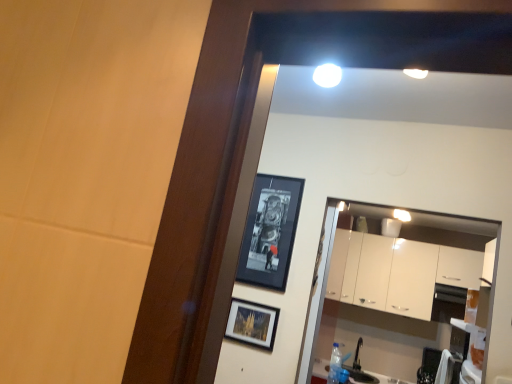
The image size is (512, 384). What do you see at coordinates (270, 231) in the screenshot? I see `black glossy picture frame at upper center, the first picture frame from the top` at bounding box center [270, 231].

The width and height of the screenshot is (512, 384). Find the location of `white glossy cabinets at center`. white glossy cabinets at center is located at coordinates (397, 272).

From a real-world perspective, between black glossy picture frame at upper center, which is counted as the second picture frame, starting from the bottom, and white glossy cabinets at center, who is vertically higher?

From a 3D spatial view, white glossy cabinets at center is above.

From the image's perspective, who appears lower, black glossy picture frame at upper center, the first picture frame from the top, or white glossy cabinets at center?

From the image's view, white glossy cabinets at center is below.

How much distance is there between black glossy picture frame at upper center, the first picture frame from the top, and white glossy cabinets at center?

black glossy picture frame at upper center, the first picture frame from the top, is 2.39 meters from white glossy cabinets at center.

Consider the image. How many degrees apart are the facing directions of matte black picture frame at center, the second picture frame from the top, and black glossy picture frame at upper center, the first picture frame from the top?

0.00388 degrees separate the facing orientations of matte black picture frame at center, the second picture frame from the top, and black glossy picture frame at upper center, the first picture frame from the top.

The image size is (512, 384). I want to click on picture frame above the matte black picture frame at center, placed as the first picture frame when sorted from bottom to top (from a real-world perspective), so [270, 231].

Between matte black picture frame at center, the second picture frame from the top, and black glossy picture frame at upper center, which is counted as the second picture frame, starting from the bottom, which one appears on the left side from the viewer's perspective?

matte black picture frame at center, the second picture frame from the top.

Is matte black picture frame at center, the second picture frame from the top, smaller than black glossy picture frame at upper center, the first picture frame from the top?

Indeed, matte black picture frame at center, the second picture frame from the top, has a smaller size compared to black glossy picture frame at upper center, the first picture frame from the top.

Is white glossy cabinets at center next to matte black picture frame at center, the second picture frame from the top, and touching it?

white glossy cabinets at center is not next to matte black picture frame at center, the second picture frame from the top, and they're not touching.

Considering the sizes of objects white glossy cabinets at center and matte black picture frame at center, placed as the first picture frame when sorted from bottom to top, in the image provided, who is wider, white glossy cabinets at center or matte black picture frame at center, placed as the first picture frame when sorted from bottom to top,?

white glossy cabinets at center is wider.

What's the angular difference between white glossy cabinets at center and matte black picture frame at center, the second picture frame from the top,'s facing directions?

There is a 1.65-degree angle between the facing directions of white glossy cabinets at center and matte black picture frame at center, the second picture frame from the top.

Is white glossy cabinets at center bigger than matte black picture frame at center, the second picture frame from the top?

Yes, white glossy cabinets at center is bigger than matte black picture frame at center, the second picture frame from the top.

Is white glossy cabinets at center to the left or to the right of black glossy picture frame at upper center, the first picture frame from the top, in the image?

white glossy cabinets at center is to the right of black glossy picture frame at upper center, the first picture frame from the top.

Is white glossy cabinets at center behind black glossy picture frame at upper center, which is counted as the second picture frame, starting from the bottom?

That is True.

Is white glossy cabinets at center shorter than black glossy picture frame at upper center, which is counted as the second picture frame, starting from the bottom?

In fact, white glossy cabinets at center may be taller than black glossy picture frame at upper center, which is counted as the second picture frame, starting from the bottom.

Is point (447, 284) closer or farther from the camera than point (277, 273)?

Point (447, 284).

Looking at this image, is black glossy picture frame at upper center, which is counted as the second picture frame, starting from the bottom, aimed at matte black picture frame at center, placed as the first picture frame when sorted from bottom to top?

No, black glossy picture frame at upper center, which is counted as the second picture frame, starting from the bottom, is not facing towards matte black picture frame at center, placed as the first picture frame when sorted from bottom to top.

Looking at this image, does black glossy picture frame at upper center, which is counted as the second picture frame, starting from the bottom, have a larger size compared to matte black picture frame at center, placed as the first picture frame when sorted from bottom to top?

Correct, black glossy picture frame at upper center, which is counted as the second picture frame, starting from the bottom, is larger in size than matte black picture frame at center, placed as the first picture frame when sorted from bottom to top.

Is black glossy picture frame at upper center, the first picture frame from the top, in contact with matte black picture frame at center, the second picture frame from the top?

No, black glossy picture frame at upper center, the first picture frame from the top, is not making contact with matte black picture frame at center, the second picture frame from the top.

Where is `picture frame in front of the black glossy picture frame at upper center, which is counted as the second picture frame, starting from the bottom`? picture frame in front of the black glossy picture frame at upper center, which is counted as the second picture frame, starting from the bottom is located at coordinates (252, 324).

Could you tell me if matte black picture frame at center, the second picture frame from the top, is turned towards white glossy cabinets at center?

No, matte black picture frame at center, the second picture frame from the top, is not aimed at white glossy cabinets at center.

Is matte black picture frame at center, the second picture frame from the top, positioned before white glossy cabinets at center?

Yes, matte black picture frame at center, the second picture frame from the top, is closer to the viewer.

Can you confirm if matte black picture frame at center, placed as the first picture frame when sorted from bottom to top, is smaller than white glossy cabinets at center?

Correct, matte black picture frame at center, placed as the first picture frame when sorted from bottom to top, occupies less space than white glossy cabinets at center.

From the picture: Considering the relative positions of matte black picture frame at center, placed as the first picture frame when sorted from bottom to top, and white glossy cabinets at center in the image provided, is matte black picture frame at center, placed as the first picture frame when sorted from bottom to top, to the left or to the right of white glossy cabinets at center?

From the image, it's evident that matte black picture frame at center, placed as the first picture frame when sorted from bottom to top, is to the left of white glossy cabinets at center.

Where is `cabinetry that appears above the black glossy picture frame at upper center, the first picture frame from the top (from a real-world perspective)`? The height and width of the screenshot is (384, 512). cabinetry that appears above the black glossy picture frame at upper center, the first picture frame from the top (from a real-world perspective) is located at coordinates (397, 272).

Where is `picture frame on the left of the black glossy picture frame at upper center, the first picture frame from the top`? Image resolution: width=512 pixels, height=384 pixels. picture frame on the left of the black glossy picture frame at upper center, the first picture frame from the top is located at coordinates (252, 324).

Based on the photo, looking at the image, which one is located closer to matte black picture frame at center, placed as the first picture frame when sorted from bottom to top, black glossy picture frame at upper center, the first picture frame from the top, or white glossy cabinets at center?

black glossy picture frame at upper center, the first picture frame from the top, lies closer to matte black picture frame at center, placed as the first picture frame when sorted from bottom to top, than the other object.

When comparing their distances from white glossy cabinets at center, does matte black picture frame at center, the second picture frame from the top, or black glossy picture frame at upper center, which is counted as the second picture frame, starting from the bottom, seem closer?

The object closer to white glossy cabinets at center is black glossy picture frame at upper center, which is counted as the second picture frame, starting from the bottom.

Consider the image. Based on their spatial positions, is white glossy cabinets at center or black glossy picture frame at upper center, the first picture frame from the top, closer to matte black picture frame at center, the second picture frame from the top?

The object closer to matte black picture frame at center, the second picture frame from the top, is black glossy picture frame at upper center, the first picture frame from the top.

Based on their spatial positions, is white glossy cabinets at center or matte black picture frame at center, placed as the first picture frame when sorted from bottom to top, closer to black glossy picture frame at upper center, which is counted as the second picture frame, starting from the bottom?

matte black picture frame at center, placed as the first picture frame when sorted from bottom to top.

Considering their positions, is matte black picture frame at center, placed as the first picture frame when sorted from bottom to top, positioned closer to black glossy picture frame at upper center, which is counted as the second picture frame, starting from the bottom, than white glossy cabinets at center?

matte black picture frame at center, placed as the first picture frame when sorted from bottom to top.

When comparing their distances from white glossy cabinets at center, does black glossy picture frame at upper center, which is counted as the second picture frame, starting from the bottom, or matte black picture frame at center, the second picture frame from the top, seem closer?

black glossy picture frame at upper center, which is counted as the second picture frame, starting from the bottom, lies closer to white glossy cabinets at center than the other object.

Find the location of a particular element. picture frame located between matte black picture frame at center, placed as the first picture frame when sorted from bottom to top, and white glossy cabinets at center in the depth direction is located at coordinates (270, 231).